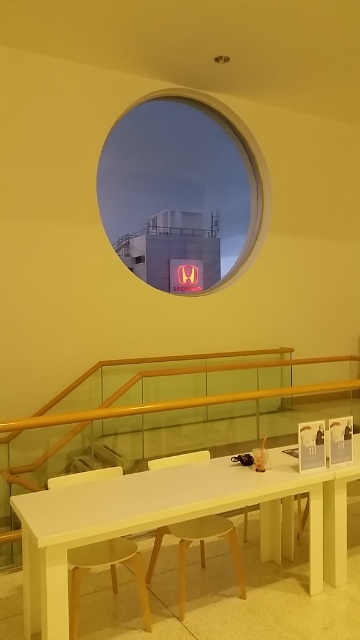
Who is positioned more to the left, light brown wooden stool at lower left or wooden stool at center?

Positioned to the left is light brown wooden stool at lower left.

Between light brown wooden stool at lower left and wooden stool at center, which one is positioned higher?

light brown wooden stool at lower left is above.

At what (x,y) coordinates should I click in order to perform the action: click on light brown wooden stool at lower left. Please return your answer as a coordinate pair (x, y). Image resolution: width=360 pixels, height=640 pixels. Looking at the image, I should click on (110, 572).

Locate an element on the screen. The width and height of the screenshot is (360, 640). light brown wooden stool at lower left is located at coordinates (110, 572).

Does red neon sign at center have a greater width compared to white matte table at lower center?

Indeed, red neon sign at center has a greater width compared to white matte table at lower center.

Is red neon sign at center smaller than white matte table at lower center?

Incorrect, red neon sign at center is not smaller in size than white matte table at lower center.

Find the location of a particular element. This screenshot has width=360, height=640. red neon sign at center is located at coordinates (178, 192).

Based on the photo, who is more forward, (x=149, y=518) or (x=78, y=557)?

Positioned in front is point (x=149, y=518).

The image size is (360, 640). What do you see at coordinates (156, 522) in the screenshot?
I see `white matte table at lower center` at bounding box center [156, 522].

Identify the location of white matte table at lower center. (x=156, y=522).